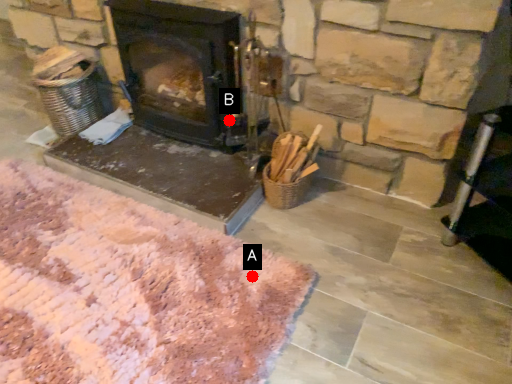
Question: Two points are circled on the image, labeled by A and B beside each circle. Among these points, which one is nearest to the camera?

Choices:
 (A) A is closer
 (B) B is closer

Answer: (A)